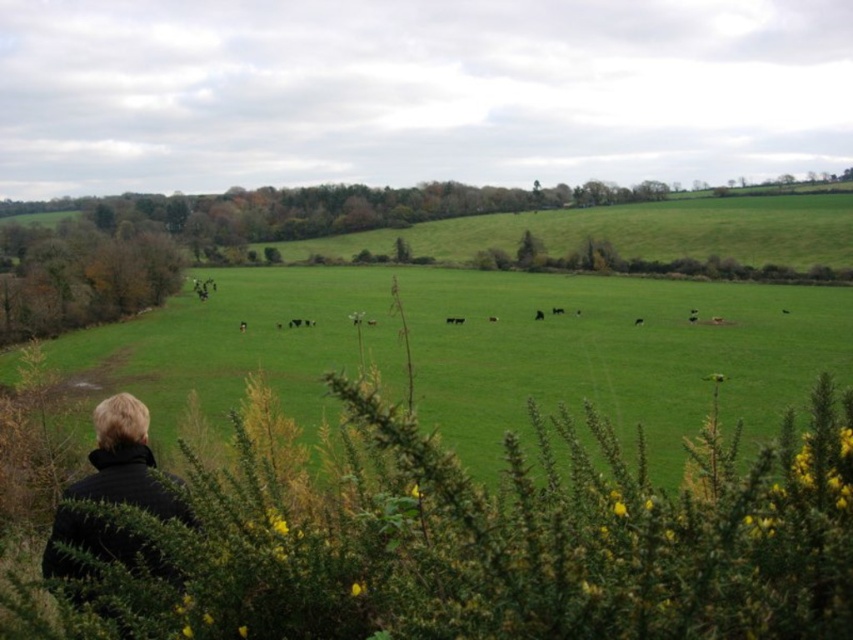
Question: Which object appears farthest from the camera in this image?

Choices:
 (A) black fabric at lower left
 (B) green grass pasture at center

Answer: (B)

Question: Can you confirm if green grass pasture at center is positioned to the right of black fabric at lower left?

Choices:
 (A) no
 (B) yes

Answer: (B)

Question: Is green grass pasture at center above black fabric at lower left?

Choices:
 (A) no
 (B) yes

Answer: (B)

Question: Does green grass pasture at center come in front of black fabric at lower left?

Choices:
 (A) yes
 (B) no

Answer: (B)

Question: Which point is farther to the camera?

Choices:
 (A) green grass pasture at center
 (B) black fabric at lower left

Answer: (A)